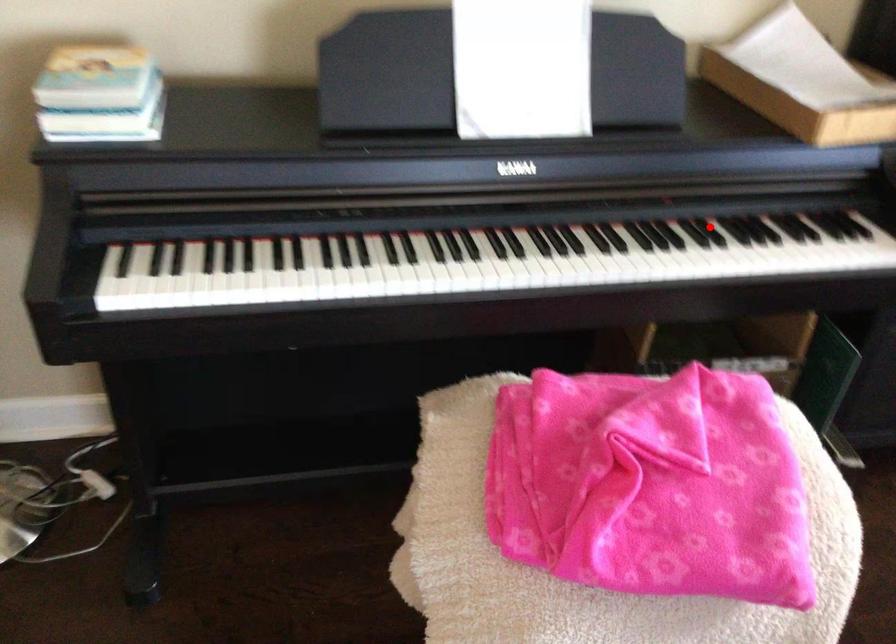
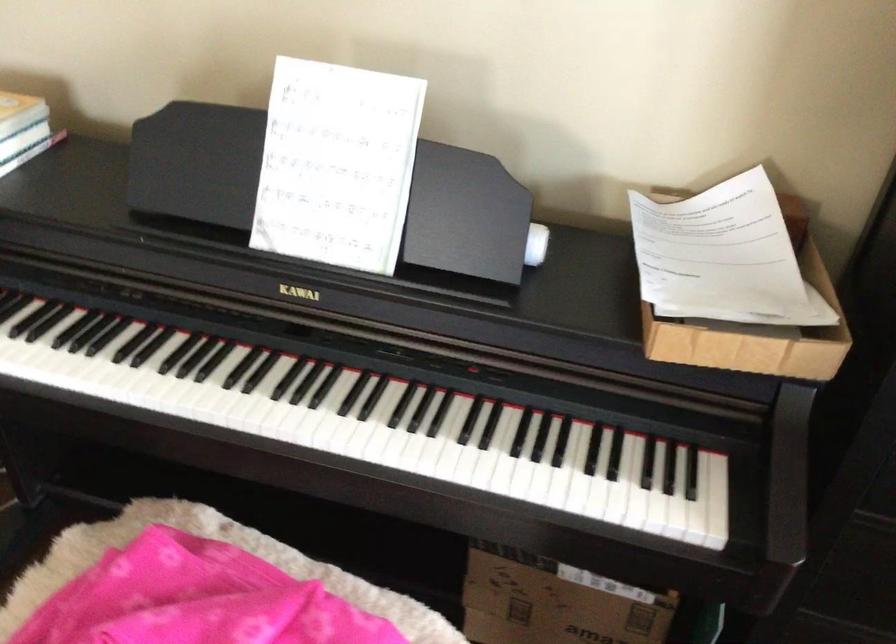
Question: I am providing you with two images of the same scene from different viewpoints. A red point is shown in image1. For the corresponding object point in image2, is it positioned nearer or farther from the camera?

Choices:
 (A) Nearer
 (B) Farther

Answer: (A)